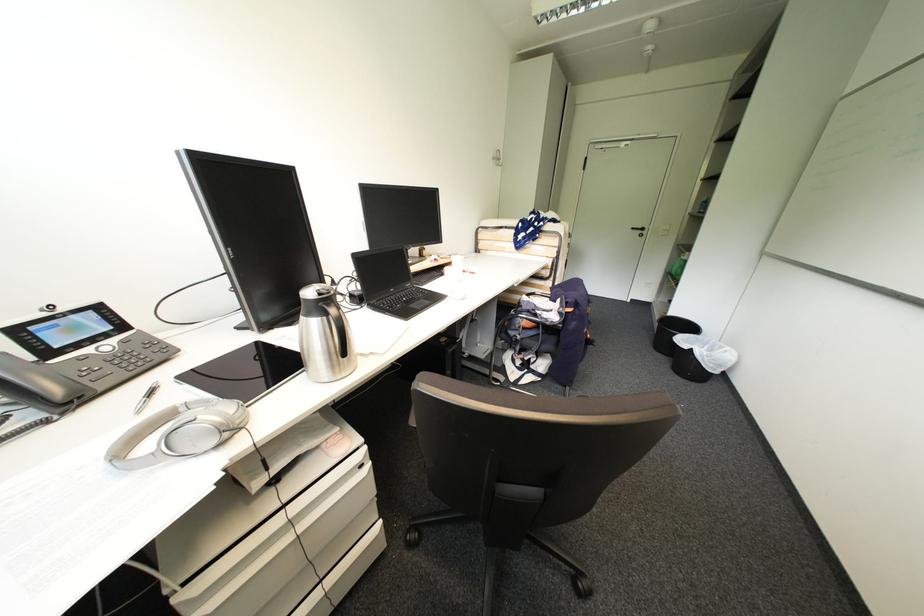
This screenshot has width=924, height=616. Identify the location of thermos handle. (336, 325).